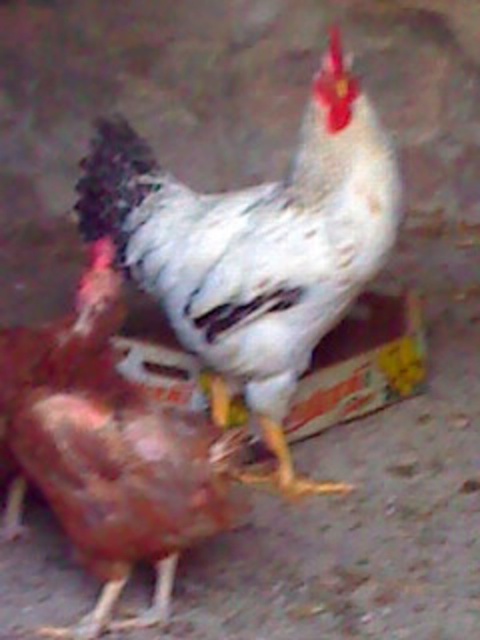
Question: Which object appears farthest from the camera in this image?

Choices:
 (A) white matte chicken at center
 (B) shiny brown chicken at center

Answer: (A)

Question: Which object is farther from the camera taking this photo?

Choices:
 (A) white matte chicken at center
 (B) shiny brown chicken at center

Answer: (A)

Question: Is white matte chicken at center positioned at the back of shiny brown chicken at center?

Choices:
 (A) no
 (B) yes

Answer: (B)

Question: Can you confirm if white matte chicken at center is thinner than shiny brown chicken at center?

Choices:
 (A) no
 (B) yes

Answer: (A)

Question: Is white matte chicken at center to the left of shiny brown chicken at center from the viewer's perspective?

Choices:
 (A) no
 (B) yes

Answer: (A)